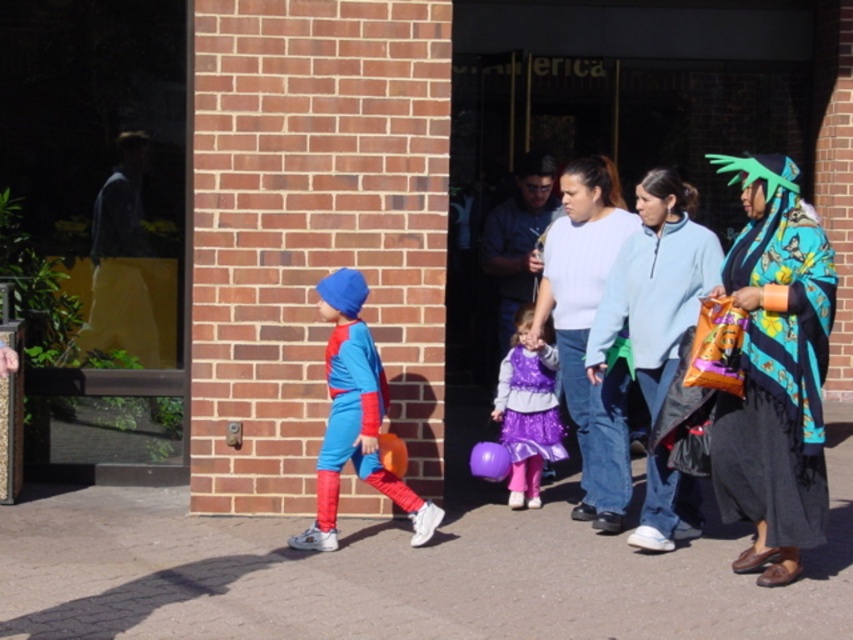
Which of these two, light blue sweater at center or purple satin dress at center, stands shorter?

With less height is purple satin dress at center.

Is point (585, 410) farther from viewer compared to point (527, 454)?

No, (585, 410) is in front of (527, 454).

You are a GUI agent. You are given a task and a screenshot of the screen. Output one action in this format:
    pyautogui.click(x=<x>, y=<y>)
    Task: Click on the light blue sweater at center
    Image resolution: width=853 pixels, height=640 pixels.
    Given the screenshot: What is the action you would take?
    pyautogui.click(x=587, y=330)

Is point (364, 390) positioned behind point (498, 403)?

No, it is in front of (498, 403).

Between matte blue and red costume at left and purple satin dress at center, which one has more height?

matte blue and red costume at left

Where is `matte blue and red costume at left`? This screenshot has width=853, height=640. matte blue and red costume at left is located at coordinates (355, 419).

Is printed silk shawl at right to the right of matte blue and red costume at left from the viewer's perspective?

Correct, you'll find printed silk shawl at right to the right of matte blue and red costume at left.

The image size is (853, 640). Describe the element at coordinates (775, 362) in the screenshot. I see `printed silk shawl at right` at that location.

Which is in front, point (726, 404) or point (331, 502)?

Point (726, 404) is more forward.

Locate an element on the screen. printed silk shawl at right is located at coordinates (775, 362).